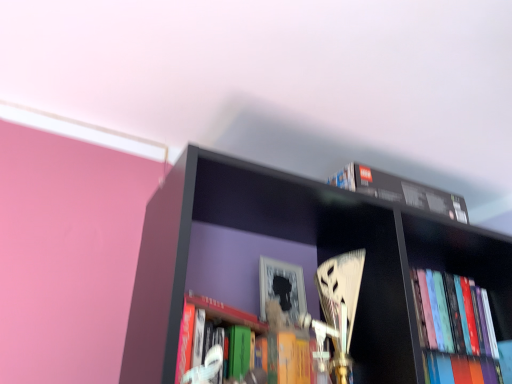
The height and width of the screenshot is (384, 512). What do you see at coordinates (456, 330) in the screenshot?
I see `hardcover books at right, positioned as the 1th book in bottom-to-top order` at bounding box center [456, 330].

What is the approximate width of hardcover books at right, positioned as the 1th book in bottom-to-top order?

hardcover books at right, positioned as the 1th book in bottom-to-top order, is 5.47 inches in width.

Where is `hardcover books at right, which ranks as the 2th book in top-to-bottom order`? The image size is (512, 384). hardcover books at right, which ranks as the 2th book in top-to-bottom order is located at coordinates (456, 330).

You are a GUI agent. You are given a task and a screenshot of the screen. Output one action in this format:
    pyautogui.click(x=<x>, y=<y>)
    Task: Click on the black matte book at upper right, which is the 2th book in bottom-to-top order
    Image resolution: width=512 pixels, height=384 pixels.
    Given the screenshot: What is the action you would take?
    pyautogui.click(x=399, y=190)

The image size is (512, 384). What do you see at coordinates (399, 190) in the screenshot? I see `black matte book at upper right, the first book when ordered from top to bottom` at bounding box center [399, 190].

At what (x,y) coordinates should I click in order to perform the action: click on hardcover books at right, positioned as the 1th book in bottom-to-top order. Please return your answer as a coordinate pair (x, y). This screenshot has width=512, height=384. Looking at the image, I should click on (456, 330).

Looking at this image, is hardcover books at right, positioned as the 1th book in bottom-to-top order, at the right side of black matte book at upper right, which is the 2th book in bottom-to-top order?

Indeed, hardcover books at right, positioned as the 1th book in bottom-to-top order, is positioned on the right side of black matte book at upper right, which is the 2th book in bottom-to-top order.

Is hardcover books at right, which ranks as the 2th book in top-to-bottom order, positioned behind black matte book at upper right, which is the 2th book in bottom-to-top order?

Yes.

Which is further, (455, 281) or (406, 187)?

The point (455, 281) is behind.

From the image's perspective, is hardcover books at right, positioned as the 1th book in bottom-to-top order, beneath black matte book at upper right, the first book when ordered from top to bottom?

Yes.

From a real-world perspective, between hardcover books at right, which ranks as the 2th book in top-to-bottom order, and black matte book at upper right, which is the 2th book in bottom-to-top order, who is vertically lower?

hardcover books at right, which ranks as the 2th book in top-to-bottom order, is physically lower.

Considering the sizes of objects hardcover books at right, positioned as the 1th book in bottom-to-top order, and black matte book at upper right, which is the 2th book in bottom-to-top order, in the image provided, who is wider, hardcover books at right, positioned as the 1th book in bottom-to-top order, or black matte book at upper right, which is the 2th book in bottom-to-top order,?

With larger width is hardcover books at right, positioned as the 1th book in bottom-to-top order.

Based on the photo, can you confirm if hardcover books at right, which ranks as the 2th book in top-to-bottom order, is shorter than black matte book at upper right, which is the 2th book in bottom-to-top order?

Incorrect, the height of hardcover books at right, which ranks as the 2th book in top-to-bottom order, does not fall short of that of black matte book at upper right, which is the 2th book in bottom-to-top order.

Looking at the image, does hardcover books at right, positioned as the 1th book in bottom-to-top order, seem bigger or smaller compared to black matte book at upper right, the first book when ordered from top to bottom?

In the image, hardcover books at right, positioned as the 1th book in bottom-to-top order, appears to be larger than black matte book at upper right, the first book when ordered from top to bottom.

In the scene shown: Can we say hardcover books at right, which ranks as the 2th book in top-to-bottom order, lies outside black matte book at upper right, which is the 2th book in bottom-to-top order?

hardcover books at right, which ranks as the 2th book in top-to-bottom order, is positioned outside black matte book at upper right, which is the 2th book in bottom-to-top order.

Is hardcover books at right, positioned as the 1th book in bottom-to-top order, touching black matte book at upper right, the first book when ordered from top to bottom?

No, hardcover books at right, positioned as the 1th book in bottom-to-top order, is not beside black matte book at upper right, the first book when ordered from top to bottom.

Is hardcover books at right, positioned as the 1th book in bottom-to-top order, facing away from black matte book at upper right, the first book when ordered from top to bottom?

No, hardcover books at right, positioned as the 1th book in bottom-to-top order, is not facing away from black matte book at upper right, the first book when ordered from top to bottom.

What's the angular difference between hardcover books at right, which ranks as the 2th book in top-to-bottom order, and black matte book at upper right, which is the 2th book in bottom-to-top order,'s facing directions?

The facing directions of hardcover books at right, which ranks as the 2th book in top-to-bottom order, and black matte book at upper right, which is the 2th book in bottom-to-top order, are 0.000516 degrees apart.

How distant is hardcover books at right, which ranks as the 2th book in top-to-bottom order, from black matte book at upper right, which is the 2th book in bottom-to-top order?

hardcover books at right, which ranks as the 2th book in top-to-bottom order, is 29.79 centimeters away from black matte book at upper right, which is the 2th book in bottom-to-top order.

Locate an element on the screen. The height and width of the screenshot is (384, 512). book that appears above the hardcover books at right, positioned as the 1th book in bottom-to-top order (from the image's perspective) is located at coordinates (399, 190).

Between black matte book at upper right, which is the 2th book in bottom-to-top order, and hardcover books at right, positioned as the 1th book in bottom-to-top order, which one appears on the right side from the viewer's perspective?

From the viewer's perspective, hardcover books at right, positioned as the 1th book in bottom-to-top order, appears more on the right side.

Consider the image. Is black matte book at upper right, the first book when ordered from top to bottom, in front of or behind hardcover books at right, positioned as the 1th book in bottom-to-top order, in the image?

black matte book at upper right, the first book when ordered from top to bottom, is positioned closer to the viewer than hardcover books at right, positioned as the 1th book in bottom-to-top order.

Is point (454, 195) farther from camera compared to point (462, 379)?

Yes, it is.

From the image's perspective, between black matte book at upper right, the first book when ordered from top to bottom, and hardcover books at right, which ranks as the 2th book in top-to-bottom order, who is located below?

hardcover books at right, which ranks as the 2th book in top-to-bottom order.

Consider the image. From a real-world perspective, does black matte book at upper right, which is the 2th book in bottom-to-top order, stand above hardcover books at right, which ranks as the 2th book in top-to-bottom order?

Yes.

Considering the relative sizes of black matte book at upper right, which is the 2th book in bottom-to-top order, and hardcover books at right, which ranks as the 2th book in top-to-bottom order, in the image provided, is black matte book at upper right, which is the 2th book in bottom-to-top order, thinner than hardcover books at right, which ranks as the 2th book in top-to-bottom order,?

Correct, the width of black matte book at upper right, which is the 2th book in bottom-to-top order, is less than that of hardcover books at right, which ranks as the 2th book in top-to-bottom order.

Can you confirm if black matte book at upper right, which is the 2th book in bottom-to-top order, is taller than hardcover books at right, which ranks as the 2th book in top-to-bottom order?

In fact, black matte book at upper right, which is the 2th book in bottom-to-top order, may be shorter than hardcover books at right, which ranks as the 2th book in top-to-bottom order.

Considering the relative sizes of black matte book at upper right, the first book when ordered from top to bottom, and hardcover books at right, positioned as the 1th book in bottom-to-top order, in the image provided, is black matte book at upper right, the first book when ordered from top to bottom, smaller than hardcover books at right, positioned as the 1th book in bottom-to-top order,?

Yes.

Do you think black matte book at upper right, which is the 2th book in bottom-to-top order, is within hardcover books at right, which ranks as the 2th book in top-to-bottom order, or outside of it?

black matte book at upper right, which is the 2th book in bottom-to-top order, is spatially situated outside hardcover books at right, which ranks as the 2th book in top-to-bottom order.

Is hardcover books at right, positioned as the 1th book in bottom-to-top order, at the back of black matte book at upper right, the first book when ordered from top to bottom?

black matte book at upper right, the first book when ordered from top to bottom, does not have its back to hardcover books at right, positioned as the 1th book in bottom-to-top order.

This screenshot has height=384, width=512. What are the coordinates of `book located above the hardcover books at right, which ranks as the 2th book in top-to-bottom order (from the image's perspective)` in the screenshot? It's located at pos(399,190).

Identify the location of book above the hardcover books at right, positioned as the 1th book in bottom-to-top order (from the image's perspective). (399, 190).

Image resolution: width=512 pixels, height=384 pixels. In order to click on book below the black matte book at upper right, which is the 2th book in bottom-to-top order (from the image's perspective) in this screenshot , I will do `click(456, 330)`.